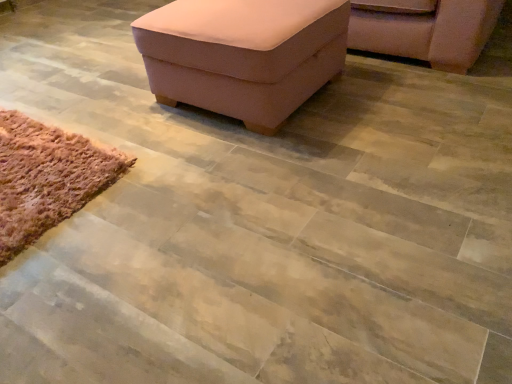
Question: Is pink fabric chair at upper right inside or outside of pink fabric ottoman at upper center?

Choices:
 (A) inside
 (B) outside

Answer: (B)

Question: In terms of width, does pink fabric chair at upper right look wider or thinner when compared to pink fabric ottoman at upper center?

Choices:
 (A) thin
 (B) wide

Answer: (B)

Question: Which object is the closest to the pink fabric chair at upper right?

Choices:
 (A) brown fuzzy rug at lower left
 (B) pink fabric ottoman at upper center

Answer: (B)

Question: Which is nearer to the pink fabric ottoman at upper center?

Choices:
 (A) pink fabric chair at upper right
 (B) brown fuzzy rug at lower left

Answer: (B)